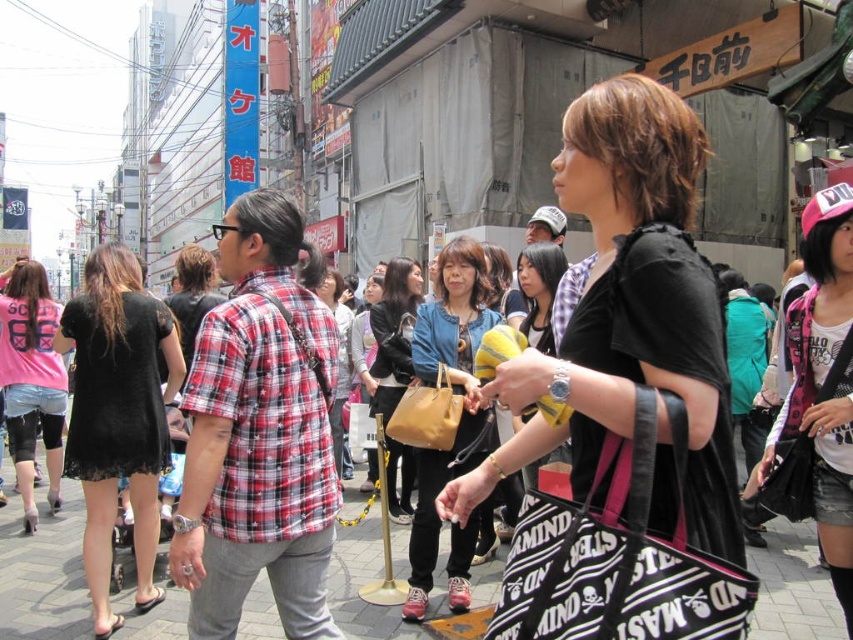
Which is below, black matte shirt at center or black lace dress at left?

black lace dress at left

Does point (541, 522) come closer to viewer compared to point (74, 449)?

Yes, it is in front of point (74, 449).

Where is `black matte shirt at center`? black matte shirt at center is located at coordinates (625, 403).

Between black matte shirt at center and plaid shirt at center, which one is positioned higher?

black matte shirt at center

Measure the distance between black matte shirt at center and camera.

black matte shirt at center and camera are 13.18 meters apart.

You are a GUI agent. You are given a task and a screenshot of the screen. Output one action in this format:
    pyautogui.click(x=<x>, y=<y>)
    Task: Click on the black matte shirt at center
    The height and width of the screenshot is (640, 853).
    Given the screenshot: What is the action you would take?
    pyautogui.click(x=625, y=403)

Is point (93, 547) positioned behind point (802, 380)?

Yes, it is behind point (802, 380).

Can you confirm if black lace dress at left is bigger than pink fabric cap at upper right?

Correct, black lace dress at left is larger in size than pink fabric cap at upper right.

You are a GUI agent. You are given a task and a screenshot of the screen. Output one action in this format:
    pyautogui.click(x=<x>, y=<y>)
    Task: Click on the black lace dress at left
    Image resolution: width=853 pixels, height=640 pixels.
    Given the screenshot: What is the action you would take?
    pyautogui.click(x=119, y=416)

Identify the location of black lace dress at left. (119, 416).